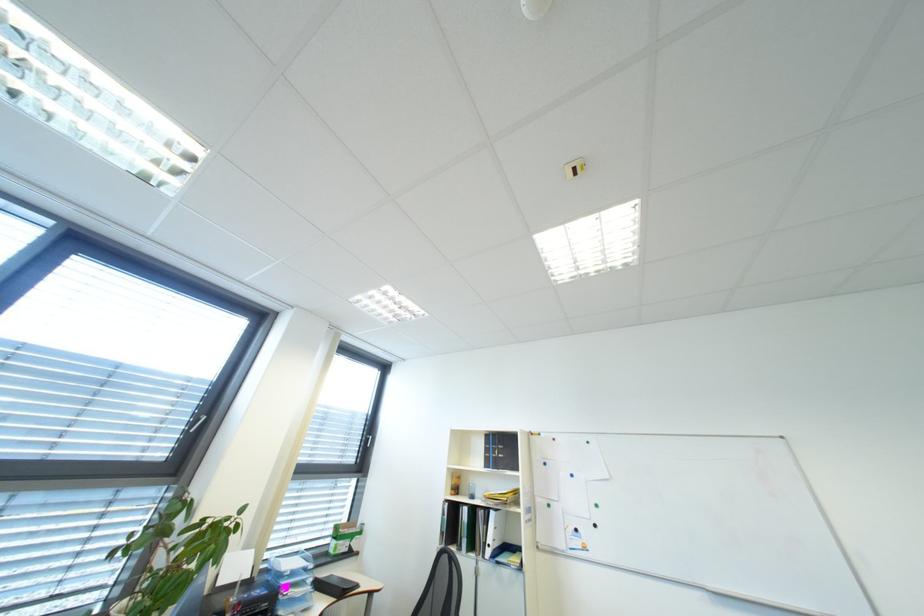
The location [470,490] corresponds to which object?

It corresponds to the small white bottle in the image.